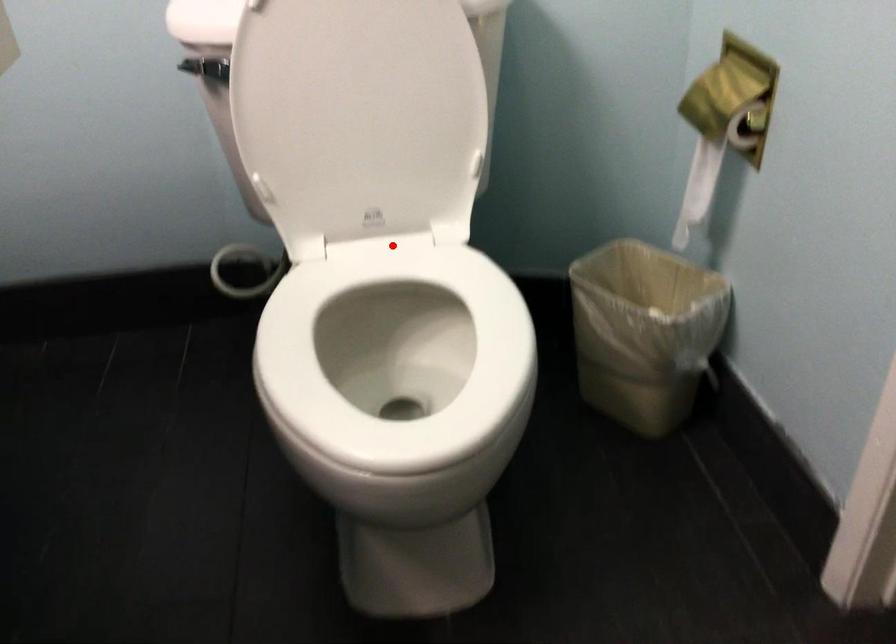
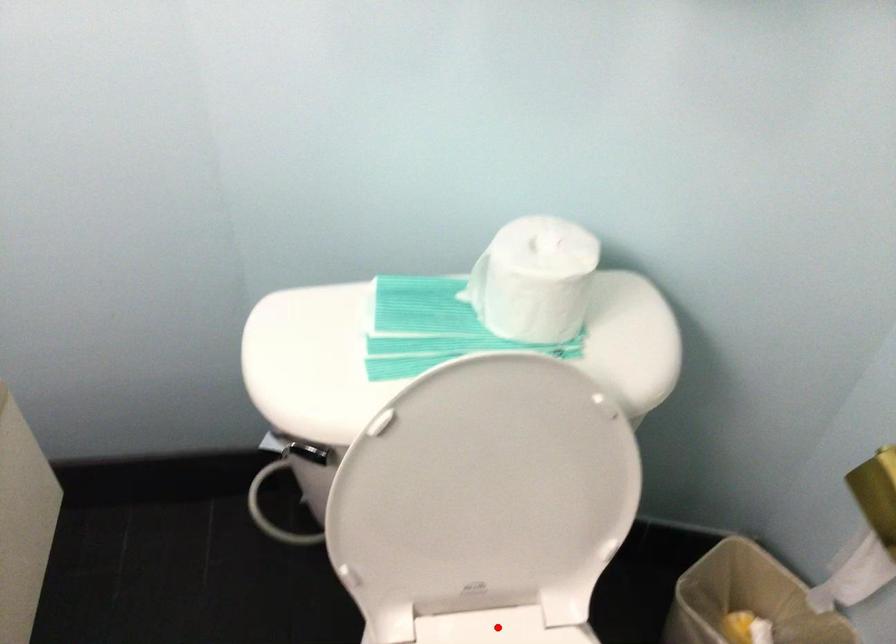
I am providing you with two images of the same scene from different viewpoints. A red point is marked on the first image and another point is marked on the second image. Is the marked point in image1 the same physical position as the marked point in image2?

Yes